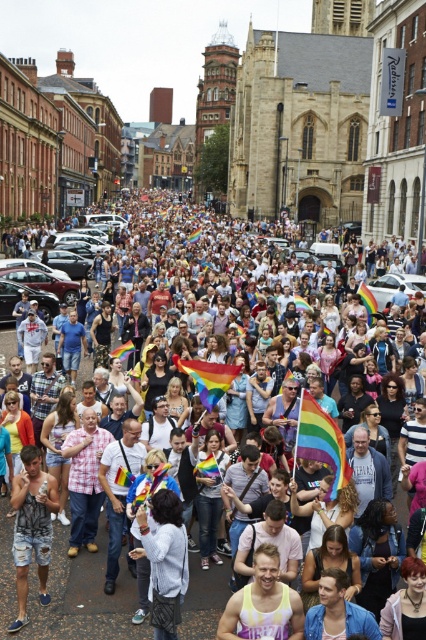
Is point (26, 566) more distant than point (241, 627)?

Yes, it is.

Between ripped denim shorts at lower left and rainbow tie-dye tank top at center, which one appears on the left side from the viewer's perspective?

From the viewer's perspective, ripped denim shorts at lower left appears more on the left side.

Is point (42, 545) positioned before point (239, 630)?

No, it is behind (239, 630).

Locate an element on the screen. The width and height of the screenshot is (426, 640). ripped denim shorts at lower left is located at coordinates (31, 525).

In the scene shown: Does rainbow flag at center appear over rainbow tie-dye tank top at center?

Indeed, rainbow flag at center is positioned over rainbow tie-dye tank top at center.

Which is below, rainbow flag at center or rainbow tie-dye tank top at center?

rainbow tie-dye tank top at center is lower down.

Between point (118, 632) and point (235, 600), which one is positioned behind?

The point (118, 632) is behind.

Where is `rainbow flag at center`? rainbow flag at center is located at coordinates (83, 600).

Who is higher up, ripped denim shorts at lower left or white cotton shirt at center?

ripped denim shorts at lower left is above.

Locate an element on the screen. This screenshot has width=426, height=640. ripped denim shorts at lower left is located at coordinates (31, 525).

Locate an element on the screen. ripped denim shorts at lower left is located at coordinates (31, 525).